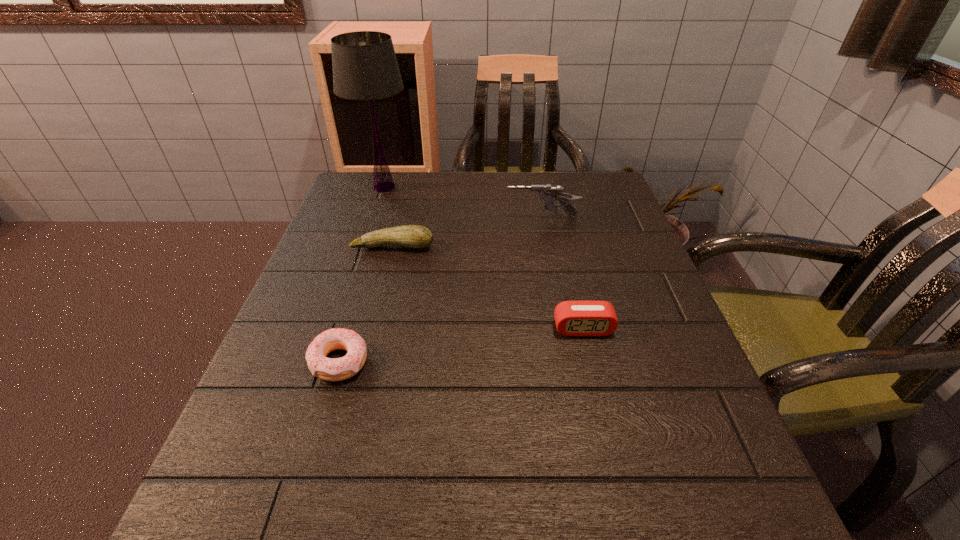
I want to click on unoccupied position between the fourth farthest object and the fourth shortest object, so click(x=563, y=273).

Identify the location of vacant space in between the alarm clock and the fourth nearest object. This screenshot has height=540, width=960. (563, 273).

Where is `free spot between the fourth farthest object and the zucchini`? free spot between the fourth farthest object and the zucchini is located at coordinates (488, 287).

Identify the location of vacant area between the zucchini and the alarm clock. (488, 287).

Locate an element on the screen. The width and height of the screenshot is (960, 540). free space between the alarm clock and the shortest object is located at coordinates (461, 345).

Find the location of a particular element. free space between the lampshade and the second tallest object is located at coordinates (463, 202).

Image resolution: width=960 pixels, height=540 pixels. I want to click on free space between the gun and the fourth farthest object, so click(563, 273).

Locate an element on the screen. This screenshot has width=960, height=540. empty location between the gun and the shortest object is located at coordinates (441, 289).

The height and width of the screenshot is (540, 960). Identify the location of vacant area that lies between the lampshade and the gun. (463, 202).

Choose which object is the nearest neighbor to the third nearest object. Please provide its 2D coordinates. Your answer should be formatted as a tuple, i.e. [(x, y)], where the tuple contains the x and y coordinates of a point satisfying the conditions above.

[(365, 68)]